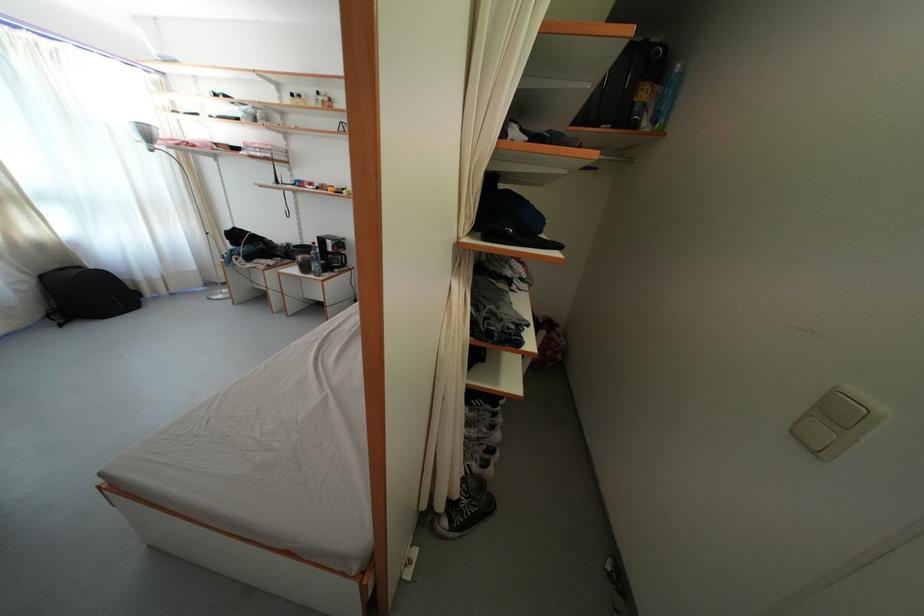
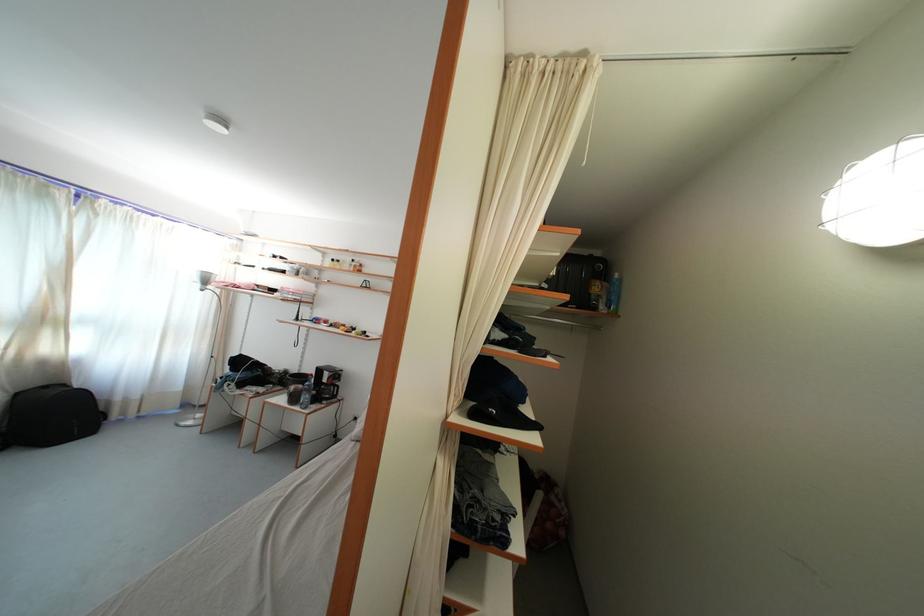
Find the pixel in the second image that matches (49,283) in the first image.

(23, 400)